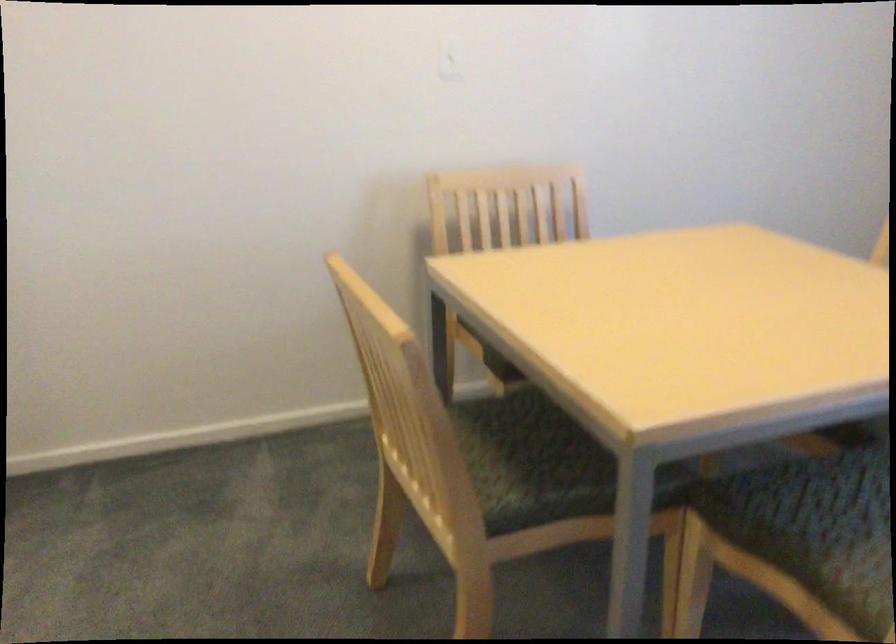
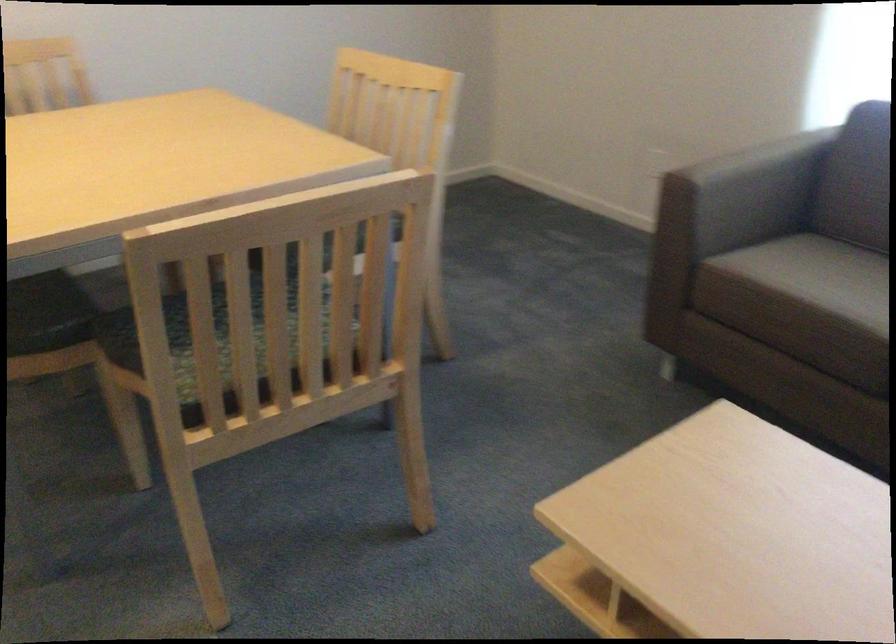
Question: I am providing you with two images of the same scene from different viewpoints. Please identify which objects are invisible in image2.

Choices:
 (A) brown sofa armrest
 (B) chair sitting surface
 (C) green chair sitting surface
 (D) pink backpack handle

Answer: (C)